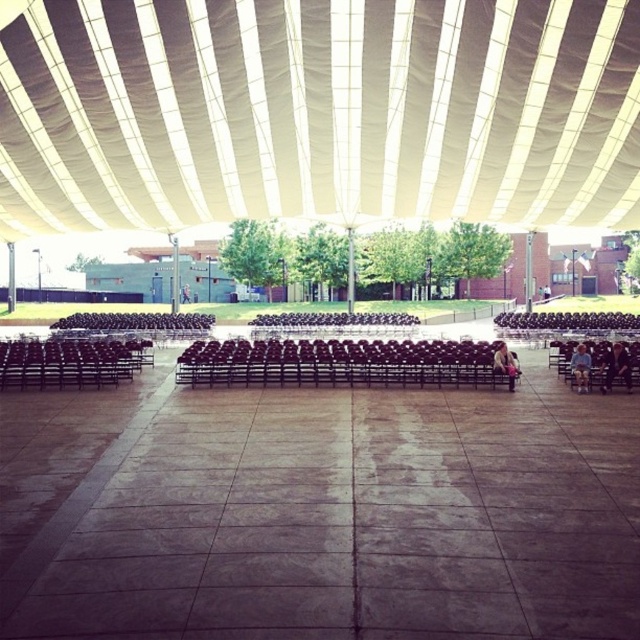
You are at an outdoor event space under a large canopy. You see a denim jacket at lower right. Where exactly is the denim jacket located relative to the point marked at coordinates (506, 364)?

The denim jacket at lower right is located exactly at the point marked at coordinates (506, 364).

You are a photographer setting up a tripod in the event space. You need to ensure that the tripod doesn not block the view of the white fabric canopy at upper center from the blue denim jeans at lower right. Given their height difference, is this possible?

The white fabric canopy at upper center has a greater height compared to blue denim jeans at lower right. Since the canopy is taller, positioning the tripod lower or closer to the ground near the blue denim jeans at lower right would allow the view of the canopy to remain unobstructed.